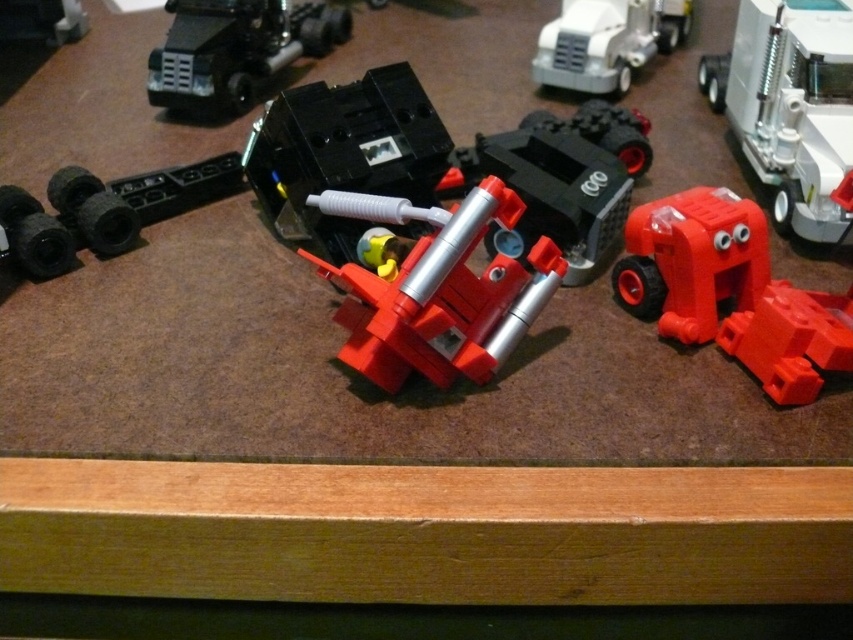
Can you confirm if matte plastic truck at right is positioned above matte black truck at upper left?

No.

Who is more forward, (773,93) or (339,19)?

Point (773,93) is in front.

Find the location of a particular element. The image size is (853, 640). matte plastic truck at right is located at coordinates (790, 106).

Can you confirm if rubberized red robot at lower right is thinner than matte plastic truck at right?

No, rubberized red robot at lower right is not thinner than matte plastic truck at right.

Can you confirm if rubberized red robot at lower right is taller than matte plastic truck at right?

No.

Identify the location of rubberized red robot at lower right. (730, 291).

Does rubberized red robot at lower right have a larger size compared to matte black truck at upper left?

No.

Based on the photo, does rubberized red robot at lower right have a greater height compared to matte black truck at upper left?

No, rubberized red robot at lower right is not taller than matte black truck at upper left.

What do you see at coordinates (730, 291) in the screenshot? I see `rubberized red robot at lower right` at bounding box center [730, 291].

At what (x,y) coordinates should I click in order to perform the action: click on rubberized red robot at lower right. Please return your answer as a coordinate pair (x, y). Looking at the image, I should click on point(730,291).